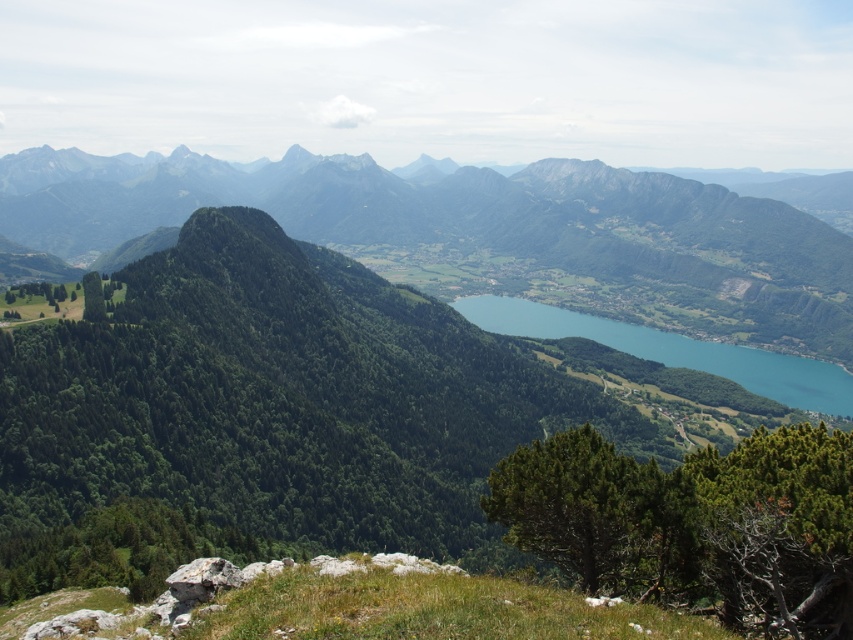
Question: Which point appears farthest from the camera in this image?

Choices:
 (A) (740, 202)
 (B) (474, 301)

Answer: (A)

Question: Is green forested mountain at center behind blue glassy lake at center?

Choices:
 (A) yes
 (B) no

Answer: (A)

Question: Is green forested mountain at center positioned behind blue glassy lake at center?

Choices:
 (A) yes
 (B) no

Answer: (A)

Question: Is green forested mountain at center positioned behind blue glassy lake at center?

Choices:
 (A) no
 (B) yes

Answer: (B)

Question: Which point is farther from the camera taking this photo?

Choices:
 (A) (576, 316)
 (B) (738, 301)

Answer: (B)